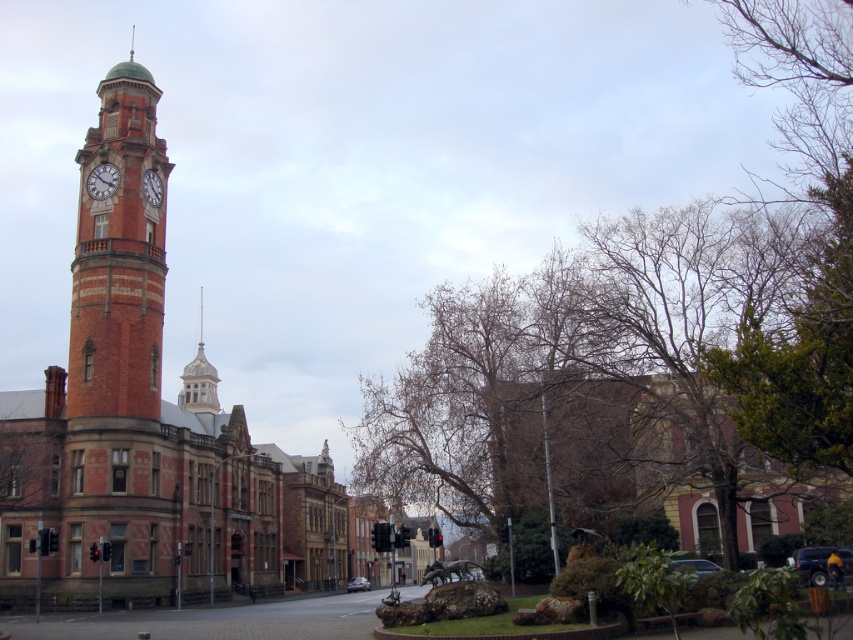
You are standing in the historic urban scene and see the point marked at coordinates point [119,259]. Which object in the scene does this point belong to?

The point [119,259] is on the brick clock tower at left.

You are standing at the center of the street in front of the historic buildings and want to take a photo of the brick clock tower at left. Based on its position, which direction should you face to ensure the tower is centered in your camera view?

Since the brick clock tower at left is located at point (119,259), you should face towards the left side of the scene to center it in your camera view.